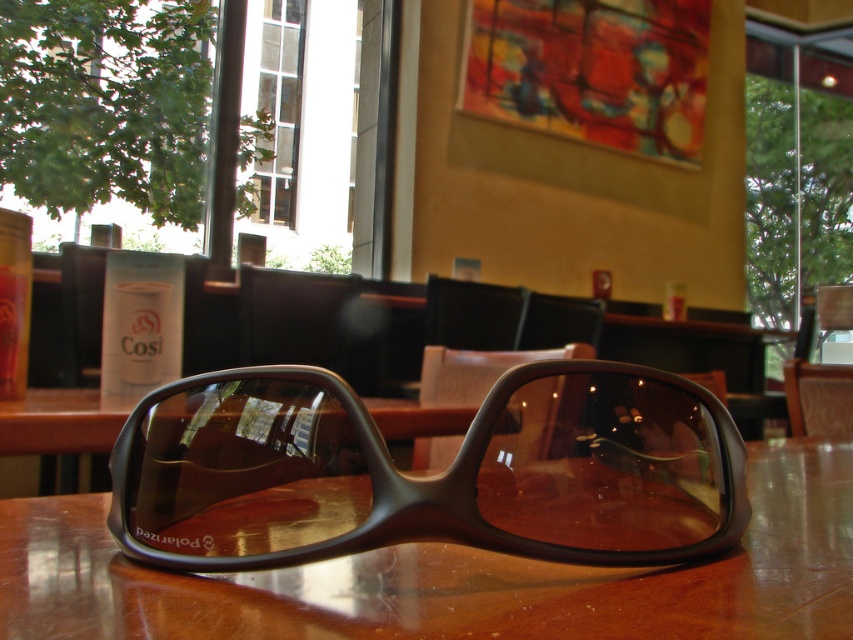
You are a customer sitting at the brown polished wood table at center in the cafe. You want to pick up the matte black sunglasses at center. Can you reach them without moving your chair?

The matte black sunglasses at center is above the brown polished wood table at center, so you can easily reach them without needing to move your chair.